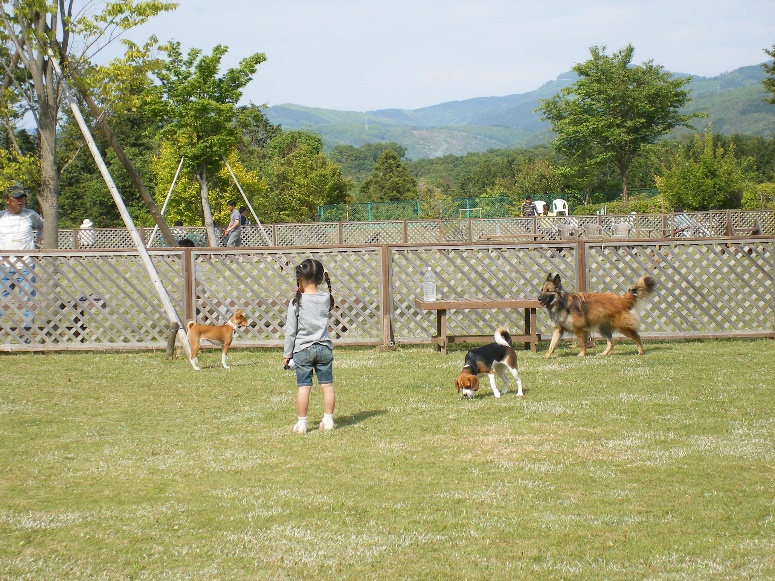
Locate an element on the screen. The image size is (775, 581). wood bench is located at coordinates (498, 306).